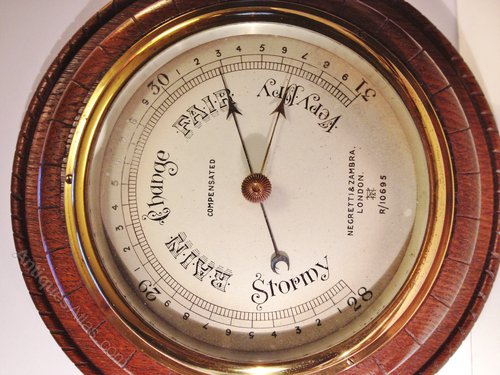
In order to click on clock hands in this screenshot , I will do `click(233, 105)`, `click(279, 107)`, `click(280, 258)`.